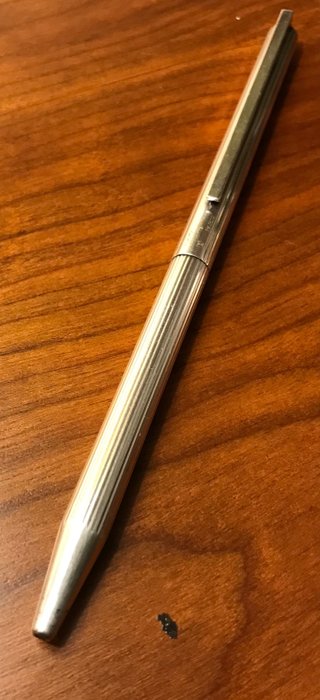
The image size is (320, 700). In order to click on pen in this screenshot , I will do `click(168, 351)`.